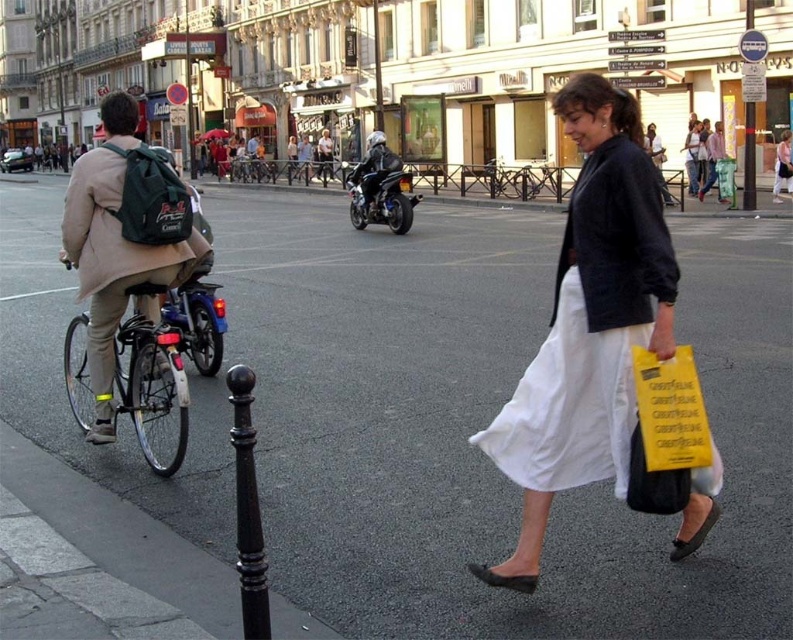
Can you confirm if matte green backpack at left is positioned to the left of white cotton skirt at lower right?

Yes, matte green backpack at left is to the left of white cotton skirt at lower right.

What do you see at coordinates (123, 237) in the screenshot? I see `matte green backpack at left` at bounding box center [123, 237].

In the scene shown: Measure the distance between point [102,305] and camera.

Point [102,305] is 18.14 feet away from camera.

The height and width of the screenshot is (640, 793). What are the coordinates of `matte green backpack at left` in the screenshot? It's located at (123, 237).

Is black asphalt at center to the right of black polished pole at lower center from the viewer's perspective?

Incorrect, black asphalt at center is not on the right side of black polished pole at lower center.

Between black asphalt at center and black polished pole at lower center, which one has more height?

Standing taller between the two is black asphalt at center.

Image resolution: width=793 pixels, height=640 pixels. What do you see at coordinates (487, 422) in the screenshot? I see `black asphalt at center` at bounding box center [487, 422].

This screenshot has height=640, width=793. Identify the location of black asphalt at center. (487, 422).

Which is in front, point (156, 332) or point (318, 141)?

Point (156, 332)

Can you confirm if silver metallic bicycle at left is positioned to the left of matte black motorcycle at center?

No, silver metallic bicycle at left is not to the left of matte black motorcycle at center.

The height and width of the screenshot is (640, 793). I want to click on silver metallic bicycle at left, so click(x=150, y=376).

The width and height of the screenshot is (793, 640). In order to click on silver metallic bicycle at left in this screenshot , I will do `click(150, 376)`.